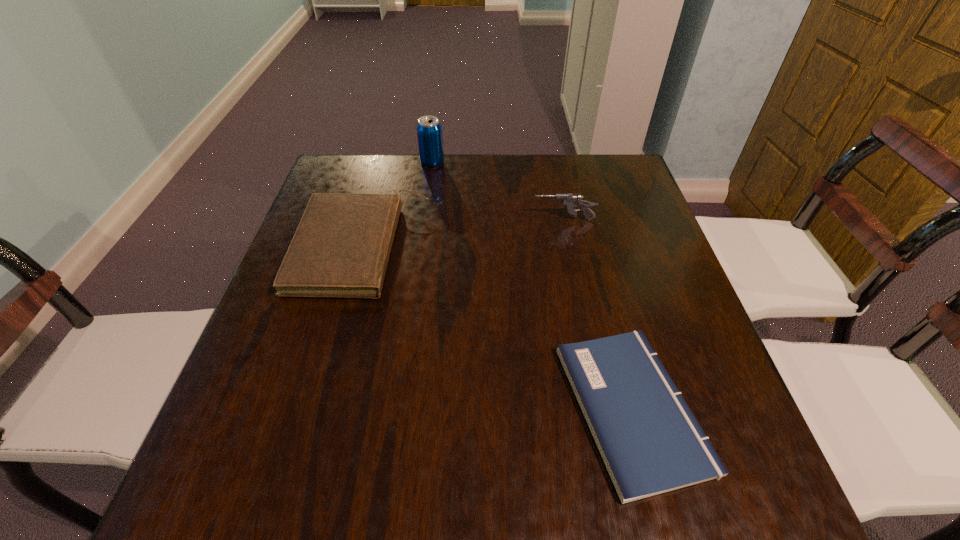
What are the coordinates of `vacant space that's between the nearest object and the tallest object` in the screenshot? It's located at (532, 285).

Where is `vacant space that's between the farthest object and the third shortest object`? vacant space that's between the farthest object and the third shortest object is located at coordinates (498, 192).

This screenshot has width=960, height=540. Find the location of `free area in between the gun and the right paperback book`. free area in between the gun and the right paperback book is located at coordinates (598, 314).

At what (x,y) coordinates should I click in order to perform the action: click on free space between the left paperback book and the second tallest object. Please return your answer as a coordinate pair (x, y). Image resolution: width=960 pixels, height=540 pixels. Looking at the image, I should click on (463, 234).

Where is `object that is the second nearest to the shortest object`? object that is the second nearest to the shortest object is located at coordinates (570, 201).

Identify which object is the second closest to the gun. Please provide its 2D coordinates. Your answer should be formatted as a tuple, i.e. [(x, y)], where the tuple contains the x and y coordinates of a point satisfying the conditions above.

[(429, 130)]

Locate an element on the screen. free location that satisfies the following two spatial constraints: 1. on the spine side of the third tallest object; 2. on the left side of the nearer paperback book is located at coordinates (317, 408).

This screenshot has height=540, width=960. In order to click on vacant area that satisfies the following two spatial constraints: 1. at the barrel of the shorter paperback book; 2. on the left side of the third shortest object in this screenshot , I will do `click(603, 408)`.

This screenshot has height=540, width=960. Find the location of `blank space that satisfies the following two spatial constraints: 1. at the barrel of the right paperback book; 2. on the left side of the gun`. blank space that satisfies the following two spatial constraints: 1. at the barrel of the right paperback book; 2. on the left side of the gun is located at coordinates (603, 408).

The width and height of the screenshot is (960, 540). In order to click on free space in the image that satisfies the following two spatial constraints: 1. at the barrel of the second tallest object; 2. on the left side of the nearer paperback book in this screenshot , I will do `click(603, 408)`.